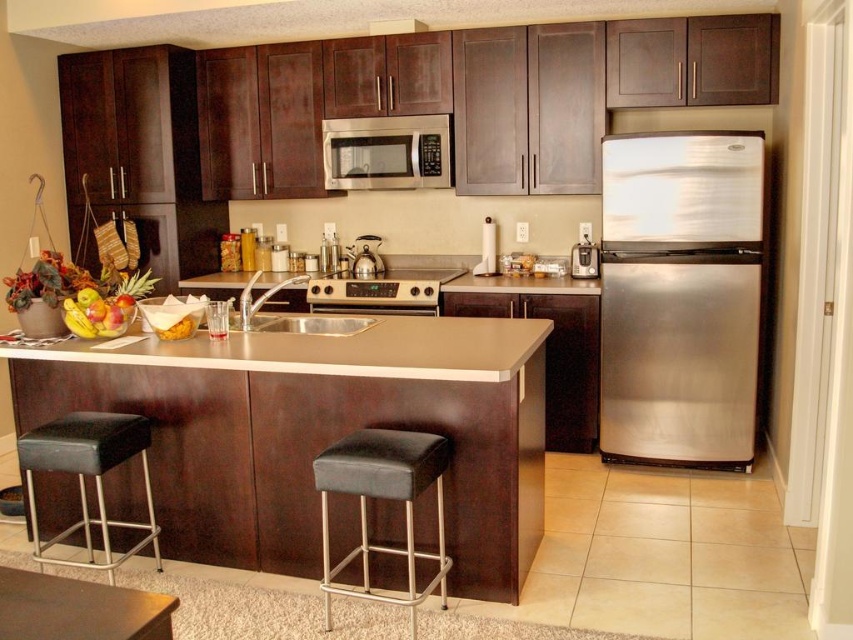
Question: Which of the following is the farthest from the observer?

Choices:
 (A) stainless steel toaster at center
 (B) matte brown counter at center
 (C) black leather bar stool at center

Answer: (A)

Question: Which object is the farthest from the black leather bar stool at lower left?

Choices:
 (A) polished stainless steel kettle at center
 (B) shiny metallic bowl of fruit at center
 (C) stainless steel microwave at center
 (D) matte brown countertop at center

Answer: (C)

Question: Does stainless steel microwave at center have a smaller size compared to polished stainless steel kettle at center?

Choices:
 (A) no
 (B) yes

Answer: (A)

Question: Does satin gold oven at center have a larger size compared to shiny metallic bowl of fruit at center?

Choices:
 (A) no
 (B) yes

Answer: (B)

Question: Considering the real-world distances, which object is closest to the stainless steel microwave at center?

Choices:
 (A) polished stainless steel kettle at center
 (B) matte brown counter at center

Answer: (A)

Question: Is black leather bar stool at center thinner than stainless steel microwave at center?

Choices:
 (A) no
 (B) yes

Answer: (B)